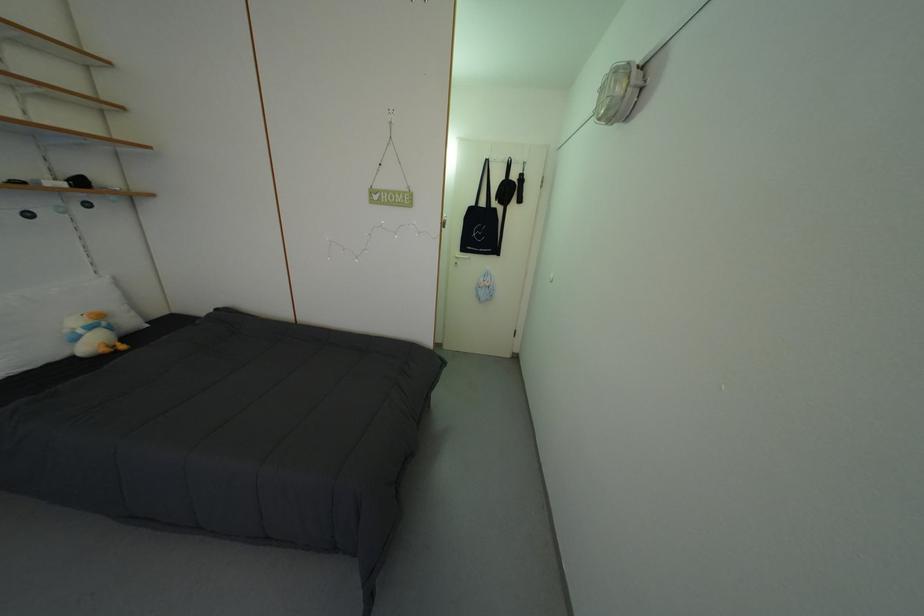
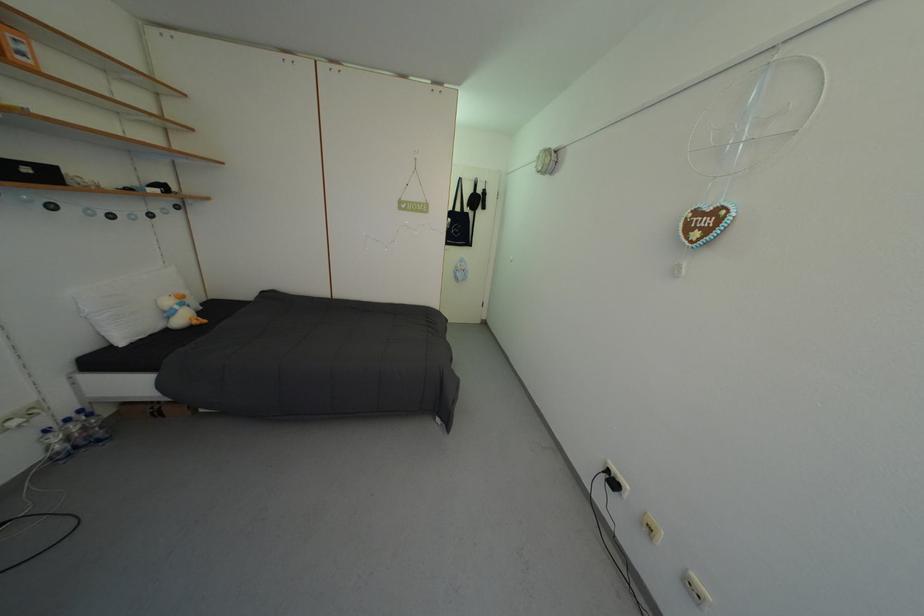
The point at (90, 338) is marked in the first image. Where is the corresponding point in the second image?

(186, 313)